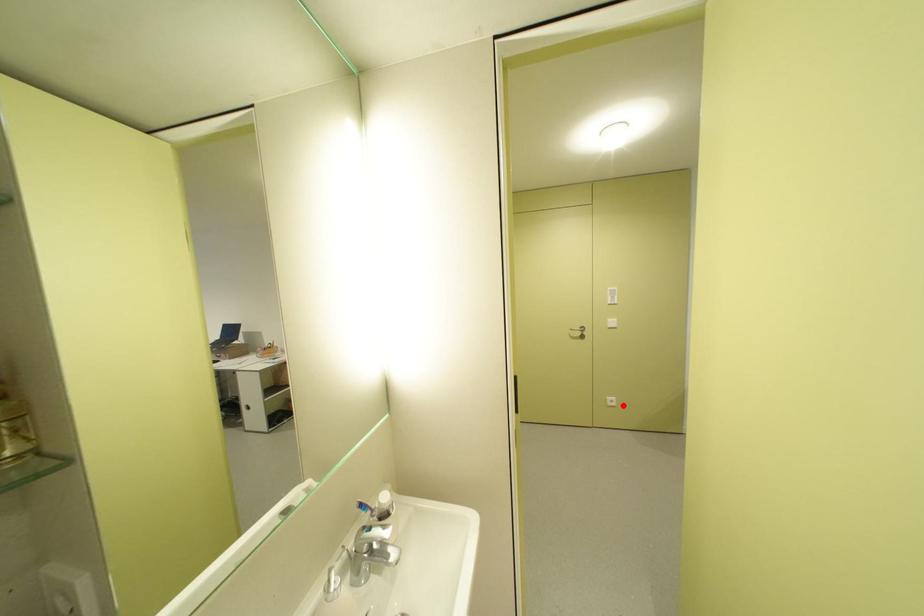
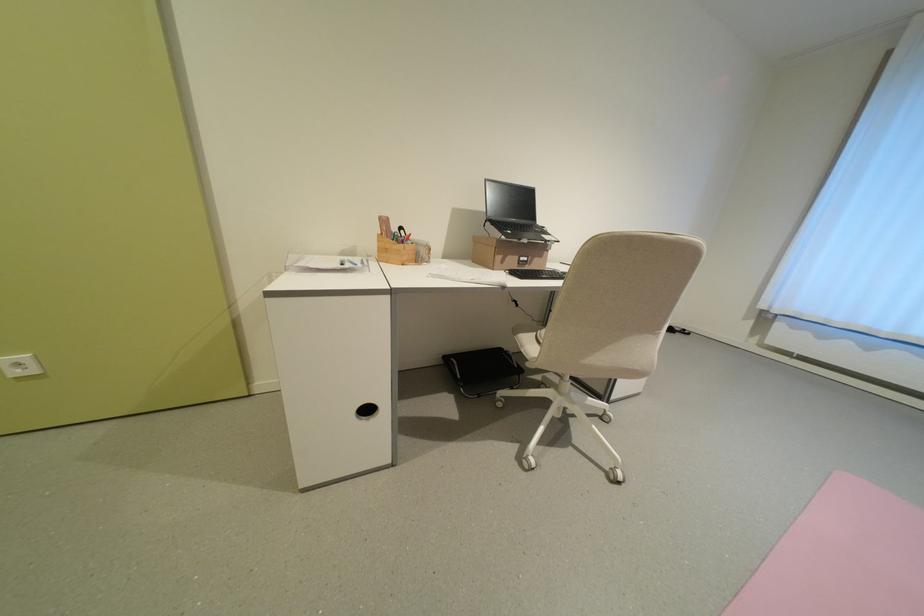
The point at the highlighted location is marked in the first image. Where is the corresponding point in the second image?

(43, 371)